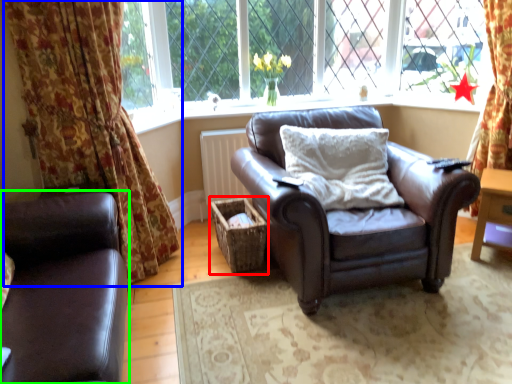
Question: Considering the real-world distances, which object is closest to crate (highlighted by a red box)? curtain (highlighted by a blue box) or studio couch (highlighted by a green box).

Choices:
 (A) curtain
 (B) studio couch

Answer: (A)